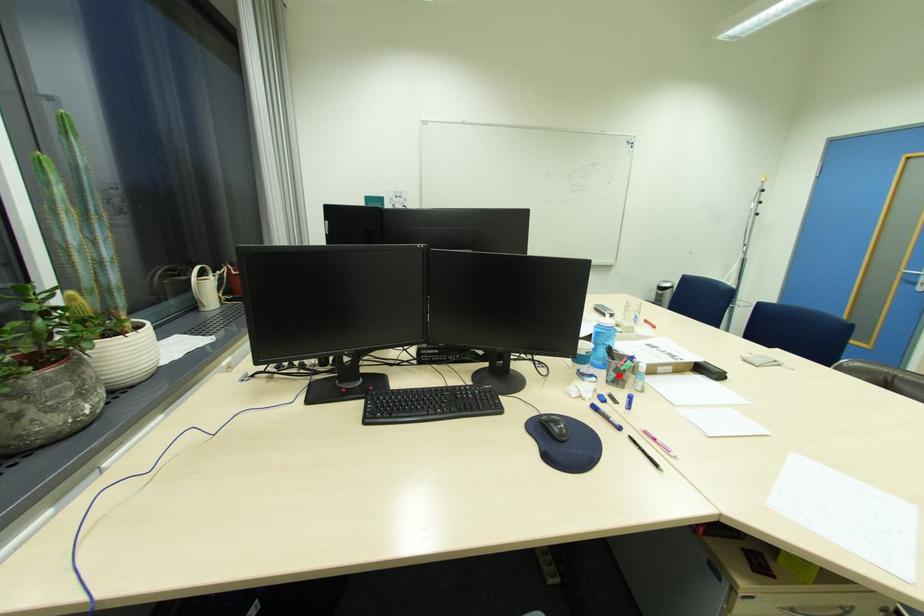
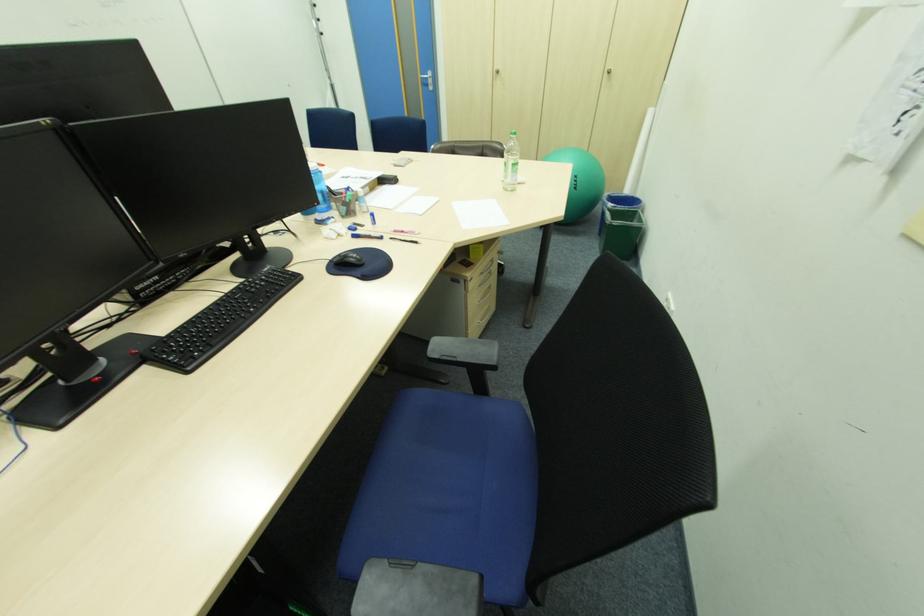
Locate, in the second image, the point that corresponds to the highlighted location in the first image.

(349, 209)